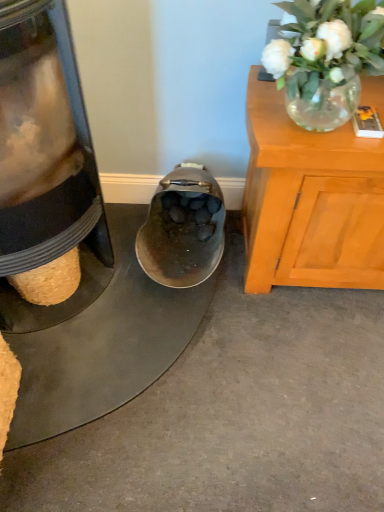
Where is `free location in front of shiny metallic shoe at center`? This screenshot has height=512, width=384. free location in front of shiny metallic shoe at center is located at coordinates (182, 345).